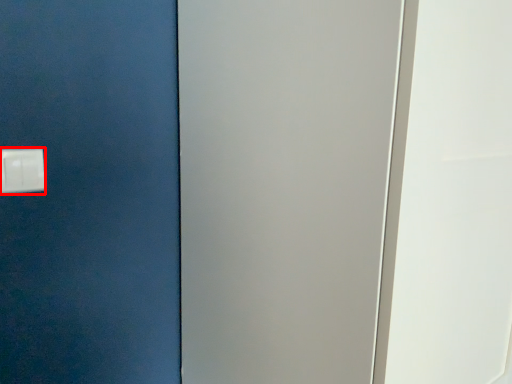
Question: From the image's perspective, what is the correct spatial positioning of light switch (annotated by the red box) in reference to screen door?

Choices:
 (A) above
 (B) below

Answer: (A)